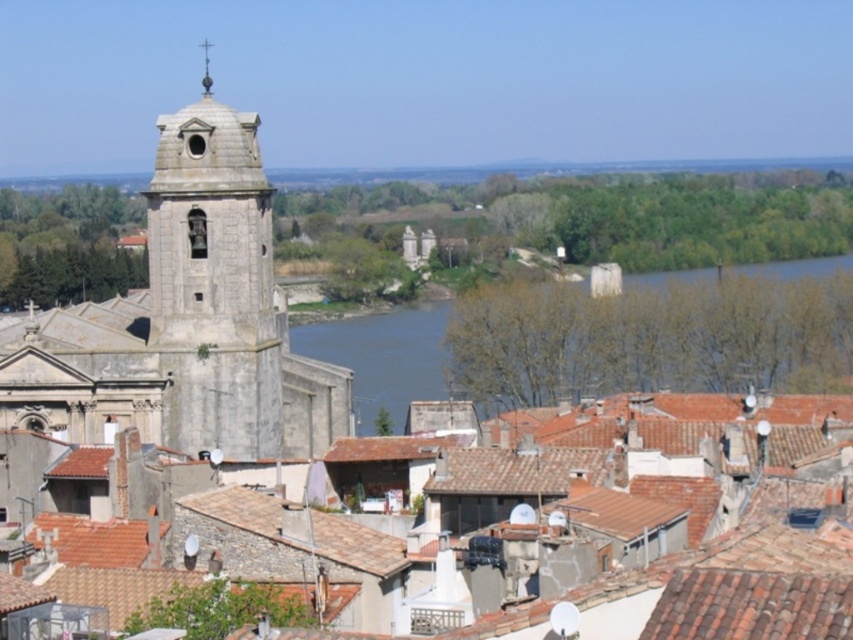
Can you confirm if gray stone church at left is positioned above smooth gray stone spire at upper center?

No.

I want to click on gray stone church at left, so click(x=184, y=321).

Is point (207, 276) farther from camera compared to point (234, 356)?

Yes, it is behind point (234, 356).

Is gray stone church at left wider than stone bell tower at left?

Indeed, gray stone church at left has a greater width compared to stone bell tower at left.

Find the location of `gray stone church at left`. gray stone church at left is located at coordinates (184, 321).

Is gray stone church at left above green water at center?

No.

Is point (71, 420) positioned behind point (706, 269)?

No, (71, 420) is in front of (706, 269).

Which is in front, point (247, 230) or point (392, 417)?

Positioned in front is point (247, 230).

Where is `gray stone church at left`? gray stone church at left is located at coordinates (184, 321).